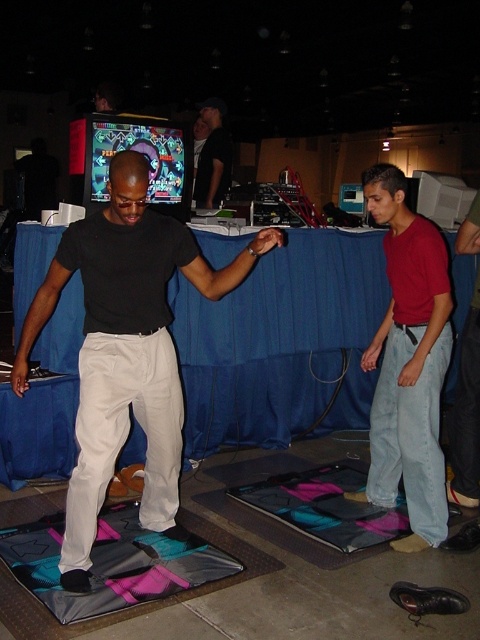
Question: Which of the following is the closest to the observer?

Choices:
 (A) shiny plastic arcade machine at center
 (B) matte black pants at center
 (C) black t-shirt at center

Answer: (B)

Question: Which object is farther from the camera taking this photo?

Choices:
 (A) black t-shirt at center
 (B) matte black pants at center
 (C) denim jeans at center
 (D) shiny plastic arcade machine at center

Answer: (A)

Question: Can you confirm if teal fabric yoga mat at lower center is positioned to the right of black t-shirt at center?

Choices:
 (A) no
 (B) yes

Answer: (A)

Question: Where is denim jeans at center located in relation to black t-shirt at center in the image?

Choices:
 (A) above
 (B) below

Answer: (B)

Question: Can you confirm if matte black pants at center is bigger than black t-shirt at center?

Choices:
 (A) no
 (B) yes

Answer: (B)

Question: Which point is farther from the camera taking this photo?

Choices:
 (A) (100, 154)
 (B) (202, 157)
 (C) (229, 548)
 (D) (377, 195)

Answer: (B)